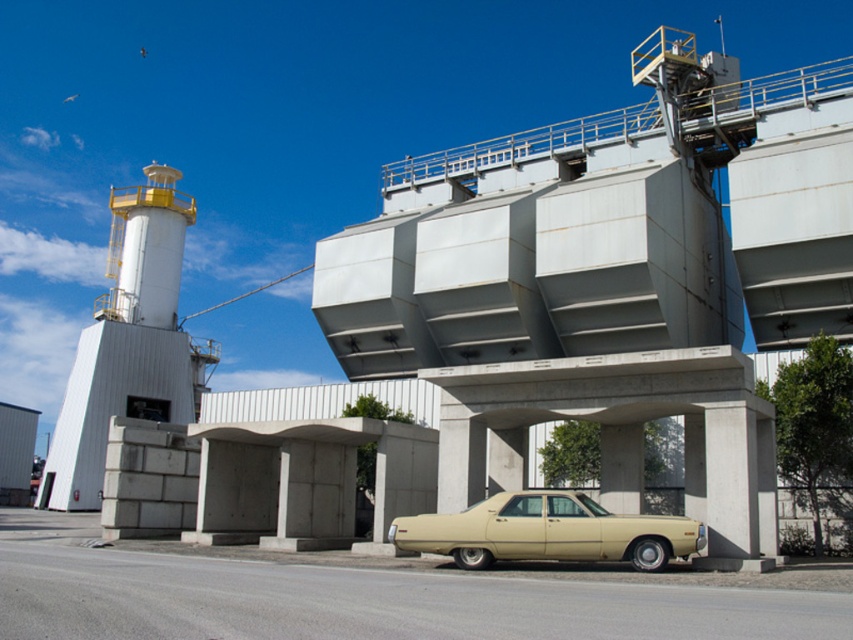
Question: Is white matte control tower at left smaller than beige matte sedan at center?

Choices:
 (A) no
 (B) yes

Answer: (A)

Question: From the image, what is the correct spatial relationship of white matte control tower at left in relation to beige matte sedan at center?

Choices:
 (A) left
 (B) right

Answer: (A)

Question: Which object is farther from the camera taking this photo?

Choices:
 (A) beige matte sedan at center
 (B) white matte control tower at left

Answer: (B)

Question: Which point is farther to the camera?

Choices:
 (A) white matte control tower at left
 (B) beige matte sedan at center

Answer: (A)

Question: Can you confirm if white matte control tower at left is thinner than beige matte sedan at center?

Choices:
 (A) no
 (B) yes

Answer: (A)